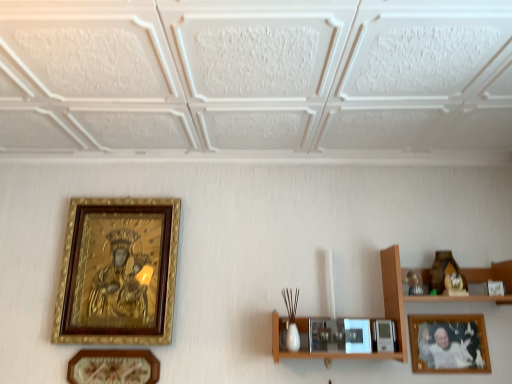
Where is `free location above goldwooden framepicture frame at left, marked as the third picture frame in a right-to-left arrangement (from a real-world perspective)`? This screenshot has height=384, width=512. free location above goldwooden framepicture frame at left, marked as the third picture frame in a right-to-left arrangement (from a real-world perspective) is located at coordinates (123, 203).